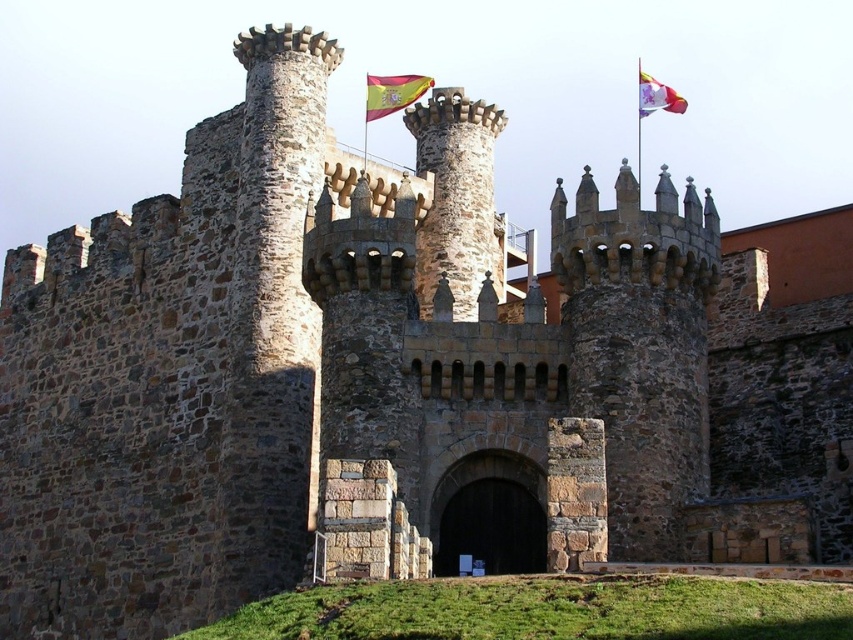
Question: Is red fabric flag at upper center thinner than white fabric flag at upper right?

Choices:
 (A) yes
 (B) no

Answer: (A)

Question: Based on their relative distances, which object is farther from the white fabric flag at upper right?

Choices:
 (A) brown wooden gate at center
 (B) red fabric flag at upper center

Answer: (A)

Question: Which object is the farthest from the red fabric flag at upper center?

Choices:
 (A) white fabric flag at upper right
 (B) brown wooden gate at center

Answer: (B)

Question: Is the position of brown wooden gate at center more distant than that of red fabric flag at upper center?

Choices:
 (A) no
 (B) yes

Answer: (A)

Question: Does brown wooden gate at center have a lesser width compared to red fabric flag at upper center?

Choices:
 (A) yes
 (B) no

Answer: (A)

Question: Estimate the real-world distances between objects in this image. Which object is closer to the white fabric flag at upper right?

Choices:
 (A) brown wooden gate at center
 (B) red fabric flag at upper center

Answer: (B)